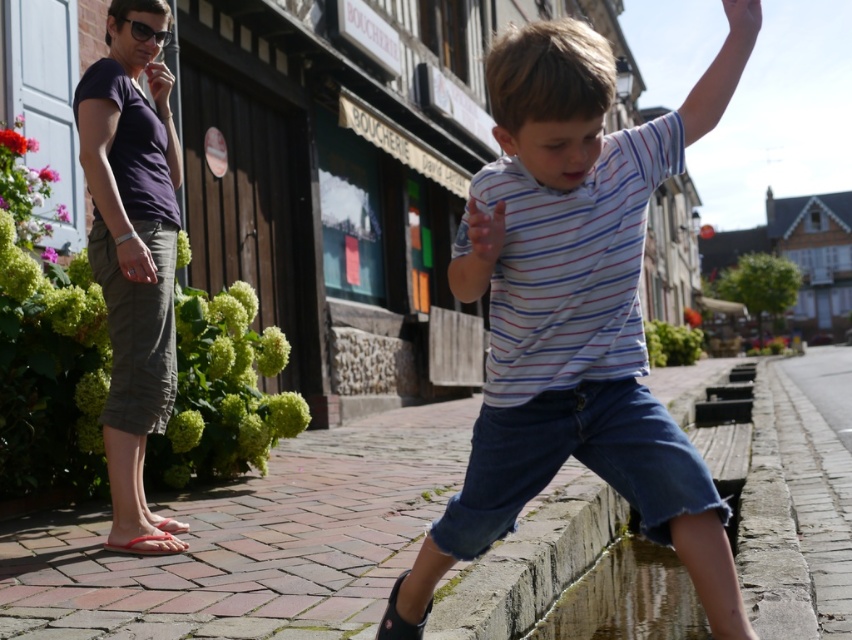
You are a photographer trying to capture the boy in his white striped shirt at center. Based on the coordinates provided, where should you position your camera to ensure the boy is centered in the frame?

The white striped shirt at center is located at coordinates point [574,310], so positioning the camera directly facing that point will center the boy in the frame.

You are a photographer trying to capture the scene of the white striped shirt at center and the clear water at lower right. Since you want both elements to be clearly visible in the photo, which object should you focus on to ensure proper depth of field?

You should focus on the white striped shirt at center because it is closer to the camera than the clear water at lower right, ensuring both are in focus.

You are a photographer standing at the camera position. You want to capture a closeup shot of the white striped shirt at center. Considering the distance, is the subject within your camera lens range if your lens can focus as close as 5 feet?

The white striped shirt at center is 7.21 feet away from the camera. Since the minimum focus distance of your lens is 5 feet, the subject is within the focus range and can be captured clearly.